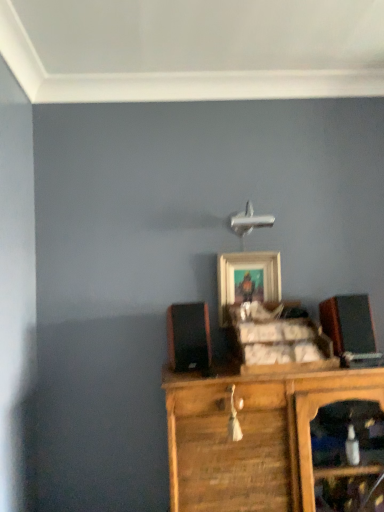
The image size is (384, 512). Find the location of `black matte speaker at left, the first speaker in the left-to-right sequence`. black matte speaker at left, the first speaker in the left-to-right sequence is located at coordinates (188, 337).

This screenshot has width=384, height=512. What do you see at coordinates (247, 279) in the screenshot? I see `wooden framed picture at center` at bounding box center [247, 279].

This screenshot has width=384, height=512. Describe the element at coordinates (348, 323) in the screenshot. I see `black matte speaker at right, which is counted as the second speaker, starting from the left` at that location.

The height and width of the screenshot is (512, 384). Describe the element at coordinates (253, 436) in the screenshot. I see `wooden cabinet at center` at that location.

Identify the location of wooden cabinet at center. The image size is (384, 512). (253, 436).

At what (x,y) coordinates should I click in order to perform the action: click on black matte speaker at left, the first speaker in the left-to-right sequence. Please return your answer as a coordinate pair (x, y). This screenshot has width=384, height=512. Looking at the image, I should click on (188, 337).

Which object is thinner, black matte speaker at left, the first speaker in the left-to-right sequence, or black matte speaker at right, which is counted as the 1th speaker, starting from the right?

With smaller width is black matte speaker at right, which is counted as the 1th speaker, starting from the right.

There is a black matte speaker at left, acting as the second speaker starting from the right. Identify the location of speaker above it (from a real-world perspective). (348, 323).

Which is closer, (x=173, y=335) or (x=368, y=304)?

The point (x=173, y=335) is closer.

From the image's perspective, would you say black matte speaker at left, the first speaker in the left-to-right sequence, is shown under black matte speaker at right, which is counted as the 1th speaker, starting from the right?

Yes, from the image's perspective, black matte speaker at left, the first speaker in the left-to-right sequence, is below black matte speaker at right, which is counted as the 1th speaker, starting from the right.

Looking at this image, is wooden cabinet at center in contact with black matte speaker at right, which is counted as the second speaker, starting from the left?

They are not placed beside each other.

Considering the relative positions of wooden cabinet at center and black matte speaker at right, which is counted as the 1th speaker, starting from the right, in the image provided, is wooden cabinet at center in front of black matte speaker at right, which is counted as the 1th speaker, starting from the right,?

Yes, it is in front of black matte speaker at right, which is counted as the 1th speaker, starting from the right.

Between wooden cabinet at center and black matte speaker at right, which is counted as the second speaker, starting from the left, which one has larger size?

wooden cabinet at center is bigger.

Is black matte speaker at right, which is counted as the 1th speaker, starting from the right, at the back of wooden cabinet at center?

wooden cabinet at center is not turned away from black matte speaker at right, which is counted as the 1th speaker, starting from the right.

From a real-world perspective, is black matte speaker at left, the first speaker in the left-to-right sequence, on top of wooden cabinet at center?

Yes, from a real-world perspective, black matte speaker at left, the first speaker in the left-to-right sequence, is over wooden cabinet at center

Can we say black matte speaker at left, acting as the second speaker starting from the right, lies outside wooden cabinet at center?

Yes.

From the image's perspective, is black matte speaker at left, the first speaker in the left-to-right sequence, above or below wooden cabinet at center?

black matte speaker at left, the first speaker in the left-to-right sequence, is situated higher than wooden cabinet at center in the image.

Is black matte speaker at left, the first speaker in the left-to-right sequence, at the right side of wooden cabinet at center?

In fact, black matte speaker at left, the first speaker in the left-to-right sequence, is to the left of wooden cabinet at center.

From a real-world perspective, who is located lower, wooden framed picture at center or wooden cabinet at center?

wooden cabinet at center, from a real-world perspective.

In the scene shown: Considering the relative sizes of wooden framed picture at center and wooden cabinet at center in the image provided, is wooden framed picture at center wider than wooden cabinet at center?

In fact, wooden framed picture at center might be narrower than wooden cabinet at center.

Does wooden framed picture at center come in front of wooden cabinet at center?

No.

What's the angular difference between wooden framed picture at center and wooden cabinet at center's facing directions?

There is a 4.73-degree angle between the facing directions of wooden framed picture at center and wooden cabinet at center.

Relative to wooden framed picture at center, is black matte speaker at left, the first speaker in the left-to-right sequence, in front or behind?

black matte speaker at left, the first speaker in the left-to-right sequence, is in front of wooden framed picture at center.

Is black matte speaker at left, acting as the second speaker starting from the right, positioned far away from wooden framed picture at center?

No.

Is black matte speaker at left, acting as the second speaker starting from the right, inside the boundaries of wooden framed picture at center, or outside?

The correct answer is: outside.

In the image, is wooden framed picture at center on the left side or the right side of black matte speaker at left, the first speaker in the left-to-right sequence?

From the image, it's evident that wooden framed picture at center is to the right of black matte speaker at left, the first speaker in the left-to-right sequence.

Does point (254, 256) come behind point (188, 346)?

Yes.

From a real-world perspective, is wooden framed picture at center located higher than black matte speaker at left, acting as the second speaker starting from the right?

Indeed, from a real-world perspective, wooden framed picture at center stands above black matte speaker at left, acting as the second speaker starting from the right.

Could you tell me if wooden framed picture at center is turned towards black matte speaker at left, acting as the second speaker starting from the right?

No.

From the image's perspective, is wooden cabinet at center positioned above or below black matte speaker at left, the first speaker in the left-to-right sequence?

wooden cabinet at center is below black matte speaker at left, the first speaker in the left-to-right sequence.

Does wooden cabinet at center touch black matte speaker at left, the first speaker in the left-to-right sequence?

There is a gap between wooden cabinet at center and black matte speaker at left, the first speaker in the left-to-right sequence.

Looking at this image, could you tell me if wooden cabinet at center is turned towards black matte speaker at left, acting as the second speaker starting from the right?

No, wooden cabinet at center is not turned towards black matte speaker at left, acting as the second speaker starting from the right.

Is point (223, 388) in front of point (178, 325)?

Yes, it is in front of point (178, 325).

At what (x,y) coordinates should I click in order to perform the action: click on speaker located in front of the black matte speaker at right, which is counted as the second speaker, starting from the left. Please return your answer as a coordinate pair (x, y). The height and width of the screenshot is (512, 384). Looking at the image, I should click on (188, 337).

At what (x,y) coordinates should I click in order to perform the action: click on chest of drawers on the left of black matte speaker at right, which is counted as the second speaker, starting from the left. Please return your answer as a coordinate pair (x, y). The image size is (384, 512). Looking at the image, I should click on (x=253, y=436).

Which object lies nearer to the anchor point black matte speaker at right, which is counted as the second speaker, starting from the left, wooden framed picture at center or wooden cabinet at center?

Based on the image, wooden framed picture at center appears to be nearer to black matte speaker at right, which is counted as the second speaker, starting from the left.

Estimate the real-world distances between objects in this image. Which object is further from wooden framed picture at center, black matte speaker at right, which is counted as the 1th speaker, starting from the right, or wooden cabinet at center?

Based on the image, wooden cabinet at center appears to be further to wooden framed picture at center.

Estimate the real-world distances between objects in this image. Which object is further from black matte speaker at right, which is counted as the 1th speaker, starting from the right, wooden cabinet at center or wooden framed picture at center?

The object further to black matte speaker at right, which is counted as the 1th speaker, starting from the right, is wooden cabinet at center.

Estimate the real-world distances between objects in this image. Which object is closer to wooden cabinet at center, black matte speaker at right, which is counted as the 1th speaker, starting from the right, or wooden framed picture at center?

black matte speaker at right, which is counted as the 1th speaker, starting from the right, is positioned closer to the anchor wooden cabinet at center.

Looking at the image, which one is located further to wooden cabinet at center, wooden framed picture at center or black matte speaker at left, acting as the second speaker starting from the right?

Based on the image, wooden framed picture at center appears to be further to wooden cabinet at center.

Looking at this image, which object lies nearer to the anchor point wooden framed picture at center, black matte speaker at right, which is counted as the second speaker, starting from the left, or black matte speaker at left, acting as the second speaker starting from the right?

black matte speaker at left, acting as the second speaker starting from the right, is closer to wooden framed picture at center.

Based on their spatial positions, is wooden cabinet at center or black matte speaker at right, which is counted as the 1th speaker, starting from the right, further from wooden framed picture at center?

Based on the image, wooden cabinet at center appears to be further to wooden framed picture at center.

Considering their positions, is black matte speaker at right, which is counted as the 1th speaker, starting from the right, positioned closer to black matte speaker at left, the first speaker in the left-to-right sequence, than wooden cabinet at center?

wooden cabinet at center lies closer to black matte speaker at left, the first speaker in the left-to-right sequence, than the other object.

Locate an element on the screen. This screenshot has width=384, height=512. chest of drawers between black matte speaker at left, acting as the second speaker starting from the right, and black matte speaker at right, which is counted as the 1th speaker, starting from the right is located at coordinates (253, 436).

Identify the location of picture frame located between black matte speaker at left, the first speaker in the left-to-right sequence, and black matte speaker at right, which is counted as the 1th speaker, starting from the right, in the left-right direction. (247, 279).